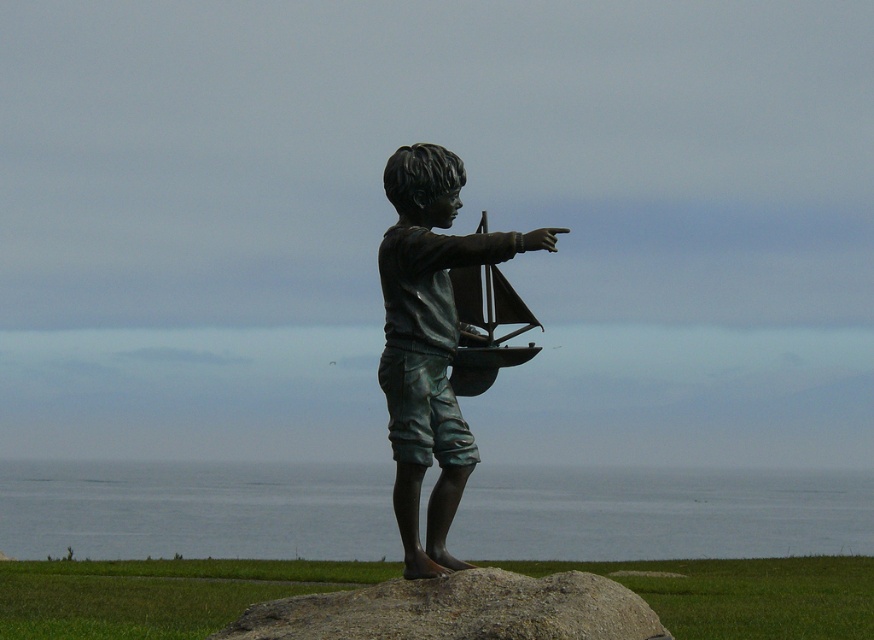
You are a photographer standing at the edge of the grassy area near the bronze statue of a young boy. You want to capture a photo that includes both the statue and the gray water at lower center. Based on their positions, where should you position yourself to ensure both elements are in the frame?

To include both the bronze statue of a young boy and the gray water at lower center in your photo, you should position yourself at the edge of the grassy area near the statue, ensuring the camera is aimed towards the lower center direction where the gray water is located at point (x=196, y=509). This placement will capture both the statue and the water in the frame.

You are a visitor at the statue and want to take a photo that shows both the bronze statue of boy pointing at center and the gray granite rock at center. Which object should you focus on first to ensure both are in frame?

The bronze statue of boy pointing at center is taller than the gray granite rock at center, so you should focus on the bronze statue of boy pointing at center first to ensure both are in frame.